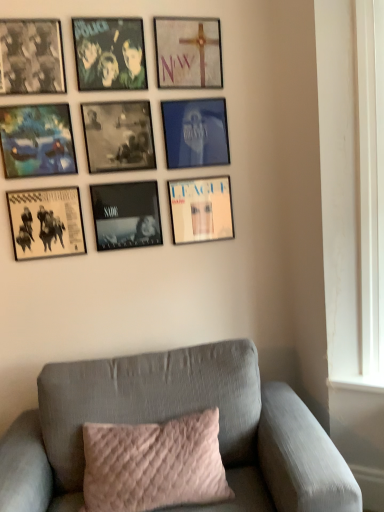
Question: Should I look upward or downward to see matte black album cover at lower left, marked as the ninth picture frame in a top-to-bottom arrangement?

Choices:
 (A) down
 (B) up

Answer: (B)

Question: Is black matte picture frame at center, the 5th picture frame from the top, surrounded by black matte picture frame at center, which is counted as the second picture frame, starting from the bottom?

Choices:
 (A) no
 (B) yes

Answer: (A)

Question: Can you confirm if black matte picture frame at center, which is counted as the second picture frame, starting from the bottom, is bigger than black matte picture frame at center, the fifth picture frame from the bottom?

Choices:
 (A) no
 (B) yes

Answer: (A)

Question: From a real-world perspective, does black matte picture frame at center, which is counted as the second picture frame, starting from the bottom, sit lower than black matte picture frame at center, the 5th picture frame from the top?

Choices:
 (A) yes
 (B) no

Answer: (A)

Question: Is black matte picture frame at center, which is counted as the second picture frame, starting from the bottom, further to the viewer compared to black matte picture frame at center, the fifth picture frame from the bottom?

Choices:
 (A) yes
 (B) no

Answer: (A)

Question: Is black matte picture frame at center, which is counted as the second picture frame, starting from the bottom, taller than black matte picture frame at center, the 5th picture frame from the top?

Choices:
 (A) yes
 (B) no

Answer: (A)

Question: Is black matte picture frame at center, the fifth picture frame from the bottom, at the back of black matte picture frame at center, arranged as the 8th picture frame when viewed from the top?

Choices:
 (A) no
 (B) yes

Answer: (A)

Question: From a real-world perspective, is matte black picture frame at upper left, arranged as the third picture frame when viewed from the top, located higher than matte white cross at upper center, acting as the 9th picture frame starting from the bottom?

Choices:
 (A) no
 (B) yes

Answer: (A)

Question: Does matte black picture frame at upper left, the seventh picture frame positioned from the bottom, appear on the right side of matte white cross at upper center, acting as the 9th picture frame starting from the bottom?

Choices:
 (A) yes
 (B) no

Answer: (B)

Question: From a real-world perspective, is matte black picture frame at upper left, the seventh picture frame positioned from the bottom, positioned under matte white cross at upper center, acting as the 9th picture frame starting from the bottom, based on gravity?

Choices:
 (A) no
 (B) yes

Answer: (B)

Question: Can you confirm if matte black picture frame at upper left, arranged as the third picture frame when viewed from the top, is taller than matte white cross at upper center, acting as the 9th picture frame starting from the bottom?

Choices:
 (A) yes
 (B) no

Answer: (B)

Question: Is matte black picture frame at upper left, arranged as the third picture frame when viewed from the top, at the left side of matte white cross at upper center, acting as the 9th picture frame starting from the bottom?

Choices:
 (A) no
 (B) yes

Answer: (B)

Question: From the image's perspective, does matte black picture frame at upper left, arranged as the third picture frame when viewed from the top, appear higher than matte white cross at upper center, acting as the 9th picture frame starting from the bottom?

Choices:
 (A) no
 (B) yes

Answer: (A)

Question: Does black matte picture frame at center, the fifth picture frame from the bottom, have a larger size compared to matte white cross at upper center, the 1th picture frame viewed from the top?

Choices:
 (A) yes
 (B) no

Answer: (A)